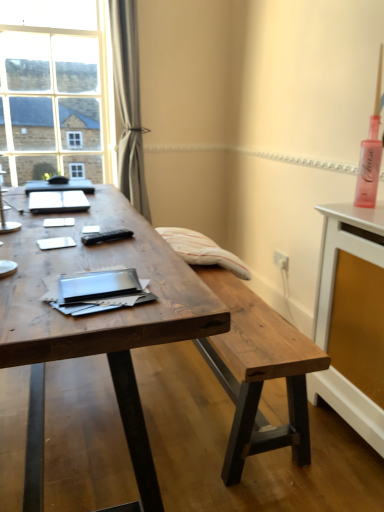
You are a GUI agent. You are given a task and a screenshot of the screen. Output one action in this format:
    pyautogui.click(x=<x>, y=<y>)
    Task: Click on the rustic wood bench at center
    This screenshot has width=384, height=512.
    Given the screenshot: What is the action you would take?
    pyautogui.click(x=258, y=372)

This screenshot has height=512, width=384. Identify the location of satin gray curtain at upper left. (128, 103).

Identify the location of wooden desk at center. (105, 313).

Locate an element on the screen. Image resolution: width=384 pixels, height=512 pixels. rustic wood bench at center is located at coordinates (258, 372).

Image resolution: width=384 pixels, height=512 pixels. Find the location of `computer desk located behind the wooden desk at center`. computer desk located behind the wooden desk at center is located at coordinates (352, 318).

Is wooden desk at center at the back of white glossy sideboard at right?

That's not correct — white glossy sideboard at right is not looking away from wooden desk at center.

Considering their positions, is white glossy sideboard at right located in front of or behind wooden desk at center?

white glossy sideboard at right is behind wooden desk at center.

Is point (355, 265) closer or farther from the camera than point (73, 349)?

Point (355, 265).

What's the angular difference between rustic wood bench at center and white glossy sideboard at right's facing directions?

rustic wood bench at center and white glossy sideboard at right are facing 0.58 degrees away from each other.

Between rustic wood bench at center and white glossy sideboard at right, which one is positioned in front?

white glossy sideboard at right is in front.

From the image's perspective, would you say rustic wood bench at center is shown under white glossy sideboard at right?

Yes, from the image's perspective, rustic wood bench at center is beneath white glossy sideboard at right.

In the scene shown: Would you say clear glass window at upper left is a long distance from rustic wood bench at center?

Yes, clear glass window at upper left and rustic wood bench at center are quite far apart.

Can we say clear glass window at upper left lies outside rustic wood bench at center?

Yes.

Which object is closer to the camera, clear glass window at upper left or rustic wood bench at center?

rustic wood bench at center is in front.

In the scene shown: How many degrees apart are the facing directions of clear glass window at upper left and rustic wood bench at center?

clear glass window at upper left and rustic wood bench at center are facing 90.6 degrees away from each other.

Which is less distant, (x=239, y=470) or (x=188, y=327)?

Point (x=239, y=470) is positioned farther from the camera compared to point (x=188, y=327).

Is rustic wood bench at center to the right of wooden desk at center from the viewer's perspective?

Indeed, rustic wood bench at center is positioned on the right side of wooden desk at center.

Considering the sizes of objects rustic wood bench at center and wooden desk at center in the image provided, who is thinner, rustic wood bench at center or wooden desk at center?

rustic wood bench at center is thinner.

Considering the sizes of rustic wood bench at center and wooden desk at center in the image, is rustic wood bench at center taller or shorter than wooden desk at center?

Considering their sizes, rustic wood bench at center has less height than wooden desk at center.

Between point (26, 314) and point (257, 447), which one is positioned in front?

Point (26, 314)

This screenshot has height=512, width=384. I want to click on desk above the rustic wood bench at center (from a real-world perspective), so click(x=105, y=313).

Considering the relative positions of wooden desk at center and rustic wood bench at center in the image provided, is wooden desk at center to the left or to the right of rustic wood bench at center?

Based on their positions, wooden desk at center is located to the left of rustic wood bench at center.

From the image's perspective, which is above, wooden desk at center or rustic wood bench at center?

wooden desk at center.

Is rustic wood bench at center positioned behind satin gray curtain at upper left?

No, rustic wood bench at center is in front of satin gray curtain at upper left.

Considering the relative sizes of rustic wood bench at center and satin gray curtain at upper left in the image provided, is rustic wood bench at center thinner than satin gray curtain at upper left?

No.

I want to click on curtain on the left of rustic wood bench at center, so click(x=128, y=103).

Considering the points (220, 349) and (131, 114), which point is behind, point (220, 349) or point (131, 114)?

The point (131, 114) is farther.

From the image's perspective, which is above, rustic wood bench at center or clear glass window at upper left?

clear glass window at upper left appears higher in the image.

Between rustic wood bench at center and clear glass window at upper left, which one has smaller size?

clear glass window at upper left is smaller.

Find the location of a particular element. window located behind the rustic wood bench at center is located at coordinates (56, 95).

The width and height of the screenshot is (384, 512). I want to click on desk lying above the white glossy sideboard at right (from the image's perspective), so click(105, 313).

At what (x,y) coordinates should I click in order to perform the action: click on bench that is behind the white glossy sideboard at right. Please return your answer as a coordinate pair (x, y). Image resolution: width=384 pixels, height=512 pixels. Looking at the image, I should click on (258, 372).

In the scene shown: From the image, which object appears to be farther from satin gray curtain at upper left, rustic wood bench at center or clear glass window at upper left?

Among the two, rustic wood bench at center is located further to satin gray curtain at upper left.

Considering their positions, is rustic wood bench at center positioned further to wooden desk at center than matte black notebook at center?

Based on the image, rustic wood bench at center appears to be further to wooden desk at center.

Estimate the real-world distances between objects in this image. Which object is closer to matte black notebook at center, wooden desk at center or white glossy sideboard at right?

wooden desk at center is positioned closer to the anchor matte black notebook at center.

When comparing their distances from clear glass window at upper left, does matte black notebook at center or wooden desk at center seem further?

wooden desk at center lies further to clear glass window at upper left than the other object.

When comparing their distances from wooden desk at center, does satin gray curtain at upper left or white glossy sideboard at right seem further?

satin gray curtain at upper left is positioned further to the anchor wooden desk at center.

Estimate the real-world distances between objects in this image. Which object is closer to matte black notebook at center, wooden desk at center or satin gray curtain at upper left?

Based on the image, wooden desk at center appears to be nearer to matte black notebook at center.

Which object lies further to the anchor point satin gray curtain at upper left, matte black notebook at center or rustic wood bench at center?

The object further to satin gray curtain at upper left is rustic wood bench at center.

Considering their positions, is wooden desk at center positioned closer to clear glass window at upper left than satin gray curtain at upper left?

Based on the image, satin gray curtain at upper left appears to be nearer to clear glass window at upper left.

This screenshot has height=512, width=384. Find the location of `curtain situated between clear glass window at upper left and white glossy sideboard at right from left to right`. curtain situated between clear glass window at upper left and white glossy sideboard at right from left to right is located at coordinates (128, 103).

Image resolution: width=384 pixels, height=512 pixels. What are the coordinates of `bench between wooden desk at center and matte black notebook at center from front to back` in the screenshot? It's located at (258, 372).

You are a GUI agent. You are given a task and a screenshot of the screen. Output one action in this format:
    pyautogui.click(x=<x>, y=<y>)
    Task: Click on the bench between wooden desk at center and clear glass window at upper left from front to back
    
    Given the screenshot: What is the action you would take?
    pos(258,372)

Identify the location of computer desk between wooden desk at center and satin gray curtain at upper left in the front-back direction. The image size is (384, 512). tap(352, 318).